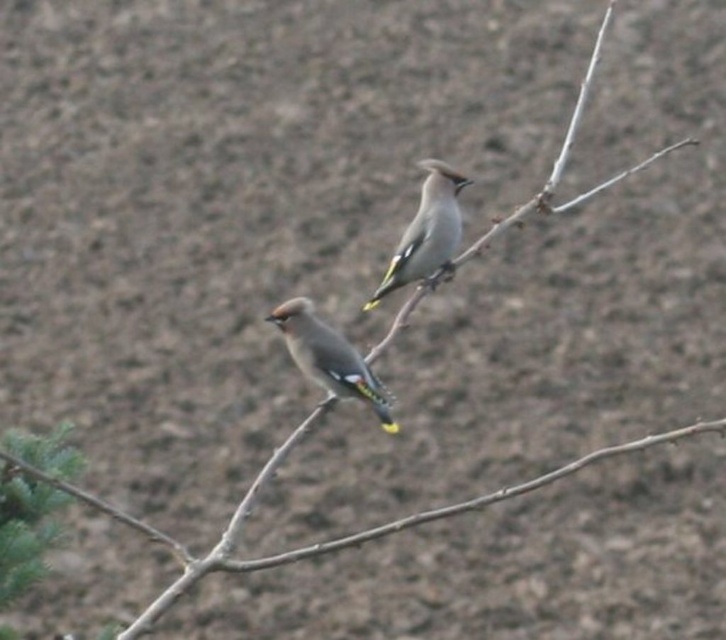
Question: Which object appears farthest from the camera in this image?

Choices:
 (A) shiny brown bird at center
 (B) speckled gray bird at center

Answer: (B)

Question: Is shiny brown bird at center positioned at the back of speckled gray bird at center?

Choices:
 (A) yes
 (B) no

Answer: (B)

Question: Considering the relative positions of shiny brown bird at center and speckled gray bird at center in the image provided, where is shiny brown bird at center located with respect to speckled gray bird at center?

Choices:
 (A) left
 (B) right

Answer: (A)

Question: Among these points, which one is nearest to the camera?

Choices:
 (A) (301, 330)
 (B) (431, 196)

Answer: (A)

Question: Can you confirm if shiny brown bird at center is positioned to the right of speckled gray bird at center?

Choices:
 (A) no
 (B) yes

Answer: (A)